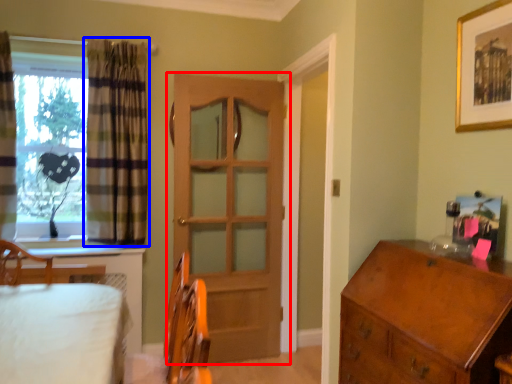
Question: Which object is further to the camera taking this photo, door (highlighted by a red box) or curtain (highlighted by a blue box)?

Choices:
 (A) door
 (B) curtain

Answer: (A)